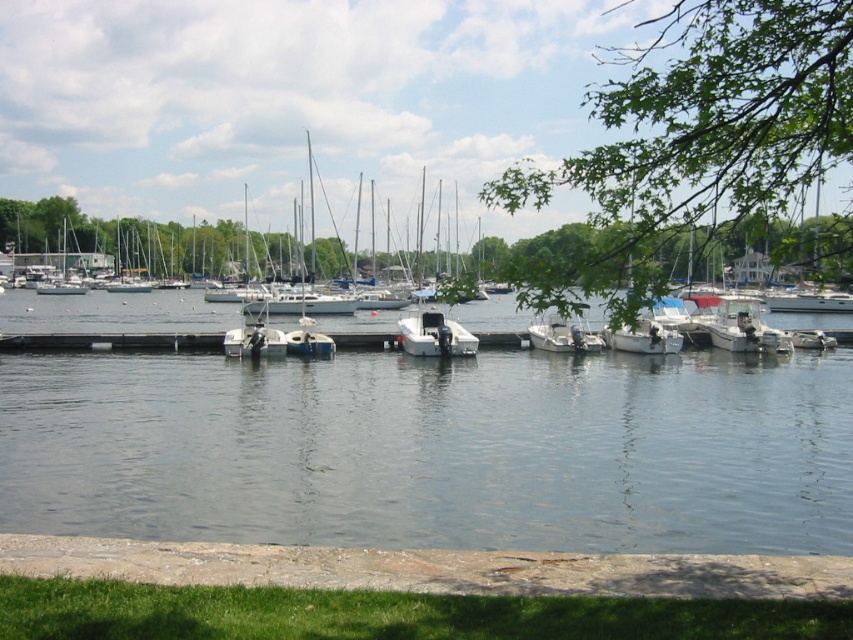
Question: Which point is farther to the camera?

Choices:
 (A) green leafy tree at upper right
 (B) white matte sailboat at center
 (C) white matte boat at center-right
 (D) transparent water at center

Answer: (B)

Question: Is transparent water at center below white matte sailboat at center?

Choices:
 (A) yes
 (B) no

Answer: (A)

Question: Estimate the real-world distances between objects in this image. Which object is farther from the white matte sailboat at center?

Choices:
 (A) white matte boat at center
 (B) green leafy tree at upper right
 (C) white matte boat at center-right

Answer: (C)

Question: Among these objects, which one is farthest from the camera?

Choices:
 (A) white matte boat at center-right
 (B) green leafy tree at upper right
 (C) white matte boat at center

Answer: (A)

Question: Considering the relative positions of white matte boat at center-right and white matte sailboat at center in the image provided, where is white matte boat at center-right located with respect to white matte sailboat at center?

Choices:
 (A) above
 (B) below

Answer: (B)

Question: Is green leafy tree at upper right positioned in front of white matte sailboat at center?

Choices:
 (A) yes
 (B) no

Answer: (A)